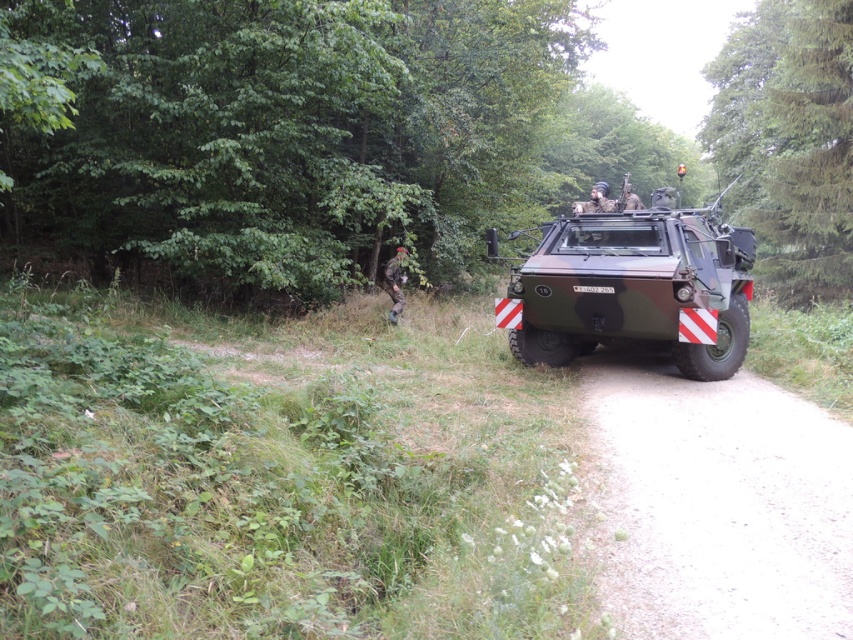
Question: Is green matte vehicle at center bigger than camouflage fabric uniform at center?

Choices:
 (A) no
 (B) yes

Answer: (B)

Question: Which object is farther from the camera taking this photo?

Choices:
 (A) matte green armored vehicle at center
 (B) green matte vehicle at center
 (C) camouflage fabric uniform at center

Answer: (C)

Question: Considering the real-world distances, which object is closest to the green matte vehicle at center?

Choices:
 (A) camouflage fabric uniform at center
 (B) matte green armored vehicle at center
 (C) dirt road at center

Answer: (B)

Question: Can you confirm if green matte vehicle at center is positioned to the right of dirt road at center?

Choices:
 (A) yes
 (B) no

Answer: (A)

Question: Which point is farther to the camera?

Choices:
 (A) (701, 336)
 (B) (766, 420)
 (C) (398, 278)
 (D) (186, 145)

Answer: (C)

Question: Does green matte vehicle at center appear under matte green armored vehicle at center?

Choices:
 (A) no
 (B) yes

Answer: (A)